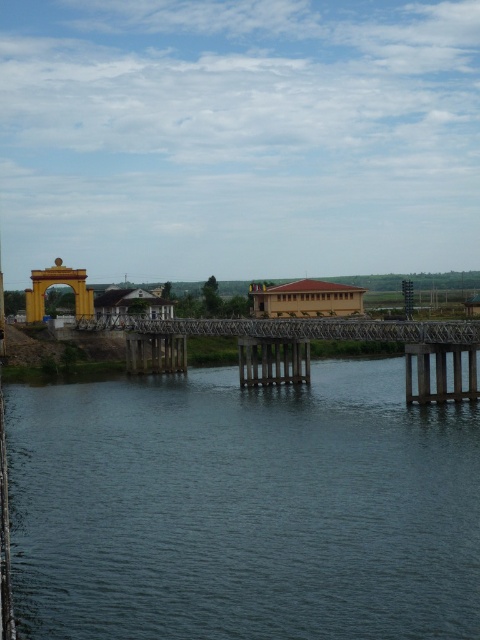
Is metallic bridge at center to the left of gold metallic archway at left from the viewer's perspective?

In fact, metallic bridge at center is to the right of gold metallic archway at left.

Which is in front, point (282, 320) or point (73, 285)?

Point (282, 320)

Is point (163, 332) positioned after point (45, 272)?

No, it is not.

You are a GUI agent. You are given a task and a screenshot of the screen. Output one action in this format:
    pyautogui.click(x=<x>, y=<y>)
    Task: Click on the metallic bridge at center
    
    Given the screenshot: What is the action you would take?
    pyautogui.click(x=354, y=339)

In the scene shown: Can you confirm if dark blue water at center is shorter than gold metallic archway at left?

Indeed, dark blue water at center has a lesser height compared to gold metallic archway at left.

Is dark blue water at center behind gold metallic archway at left?

No, dark blue water at center is in front of gold metallic archway at left.

Is point (163, 436) positioned behind point (73, 275)?

No, (163, 436) is in front of (73, 275).

The height and width of the screenshot is (640, 480). In order to click on dark blue water at center in this screenshot , I will do `click(243, 508)`.

Does dark blue water at center appear over metallic bridge at center?

A: No, dark blue water at center is not above metallic bridge at center.

Is dark blue water at center shorter than metallic bridge at center?

Yes.

Where is `dark blue water at center`? This screenshot has height=640, width=480. dark blue water at center is located at coordinates (243, 508).